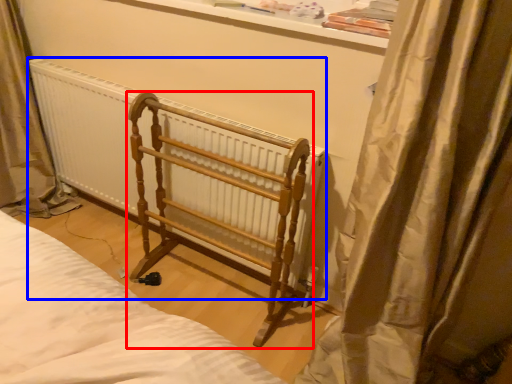
Question: Which object appears closest to the camera in this image, furniture (highlighted by a red box) or radiator (highlighted by a blue box)?

Choices:
 (A) furniture
 (B) radiator

Answer: (A)